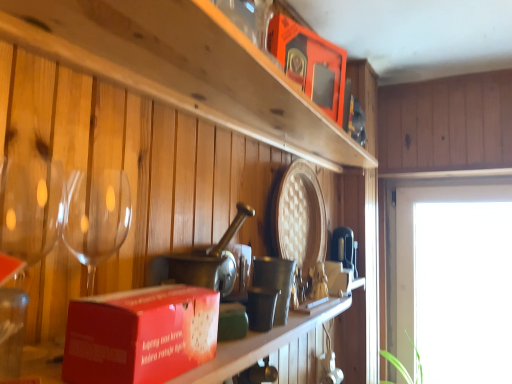
Question: Does matte red box at lower left have a smaller size compared to transparent glass window at right?

Choices:
 (A) yes
 (B) no

Answer: (A)

Question: Is matte red box at lower left further to the viewer compared to transparent glass window at right?

Choices:
 (A) yes
 (B) no

Answer: (B)

Question: Can transparent glass window at right be found inside matte red box at lower left?

Choices:
 (A) yes
 (B) no

Answer: (B)

Question: Is matte red box at lower left not near transparent glass window at right?

Choices:
 (A) no
 (B) yes

Answer: (B)

Question: Are matte red box at lower left and transparent glass window at right beside each other?

Choices:
 (A) yes
 (B) no

Answer: (B)

Question: Is wooden shelf at upper center inside the boundaries of matte red box at lower left, or outside?

Choices:
 (A) outside
 (B) inside

Answer: (A)

Question: Considering the positions of wooden shelf at upper center and matte red box at lower left in the image, is wooden shelf at upper center bigger or smaller than matte red box at lower left?

Choices:
 (A) big
 (B) small

Answer: (B)

Question: Considering the positions of wooden shelf at upper center and matte red box at lower left in the image, is wooden shelf at upper center taller or shorter than matte red box at lower left?

Choices:
 (A) tall
 (B) short

Answer: (B)

Question: In terms of width, does wooden shelf at upper center look wider or thinner when compared to matte red box at lower left?

Choices:
 (A) thin
 (B) wide

Answer: (A)

Question: Is red cardboard box at center, arranged as the 2th box when viewed from the back, inside the boundaries of metallic silver cup at center, or outside?

Choices:
 (A) inside
 (B) outside

Answer: (B)

Question: From the image's perspective, is red cardboard box at center, which is counted as the first box, starting from the bottom, above or below metallic silver cup at center?

Choices:
 (A) below
 (B) above

Answer: (B)

Question: From a real-world perspective, is red cardboard box at center, arranged as the 2th box when viewed from the back, positioned above or below metallic silver cup at center?

Choices:
 (A) above
 (B) below

Answer: (B)

Question: Considering the positions of red cardboard box at center, the 2th box positioned from the top, and metallic silver cup at center in the image, is red cardboard box at center, the 2th box positioned from the top, wider or thinner than metallic silver cup at center?

Choices:
 (A) thin
 (B) wide

Answer: (B)

Question: In terms of size, does wooden shelf at upper center appear bigger or smaller than matte orange box at upper center, the second box when ordered from front to back?

Choices:
 (A) small
 (B) big

Answer: (B)

Question: Is wooden shelf at upper center inside or outside of matte orange box at upper center, placed as the 1th box when sorted from right to left?

Choices:
 (A) outside
 (B) inside

Answer: (A)